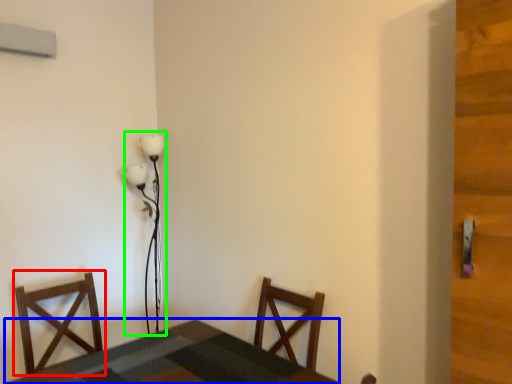
Question: Which is farther away from chair (highlighted by a red box)? table (highlighted by a blue box) or lamp (highlighted by a green box)?

Choices:
 (A) table
 (B) lamp

Answer: (B)